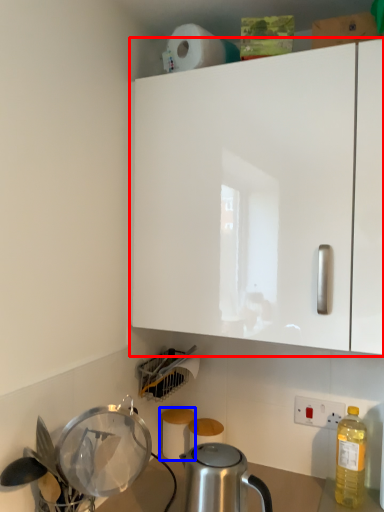
Question: Which of the following is the closest to the observer, cabinetry (highlighted by a red box) or toilet paper (highlighted by a blue box)?

Choices:
 (A) cabinetry
 (B) toilet paper

Answer: (A)